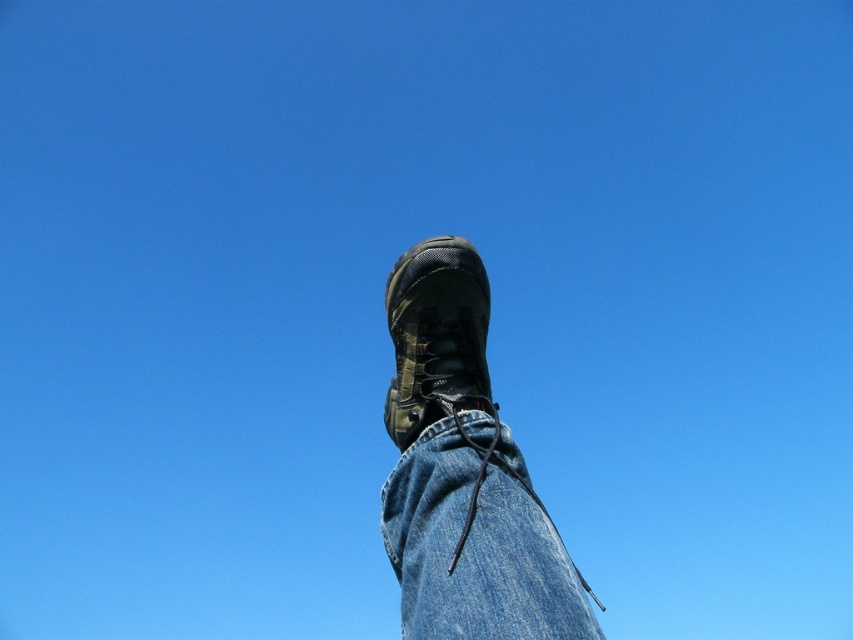
Question: Which point is farther to the camera?

Choices:
 (A) denim at center
 (B) matte black boot at center

Answer: (B)

Question: Is denim at center thinner than matte black boot at center?

Choices:
 (A) no
 (B) yes

Answer: (A)

Question: Can you confirm if denim at center is smaller than matte black boot at center?

Choices:
 (A) no
 (B) yes

Answer: (B)

Question: Which of the following is the closest to the observer?

Choices:
 (A) matte black boot at center
 (B) denim at center

Answer: (B)

Question: Can you confirm if denim at center is positioned below matte black boot at center?

Choices:
 (A) yes
 (B) no

Answer: (A)